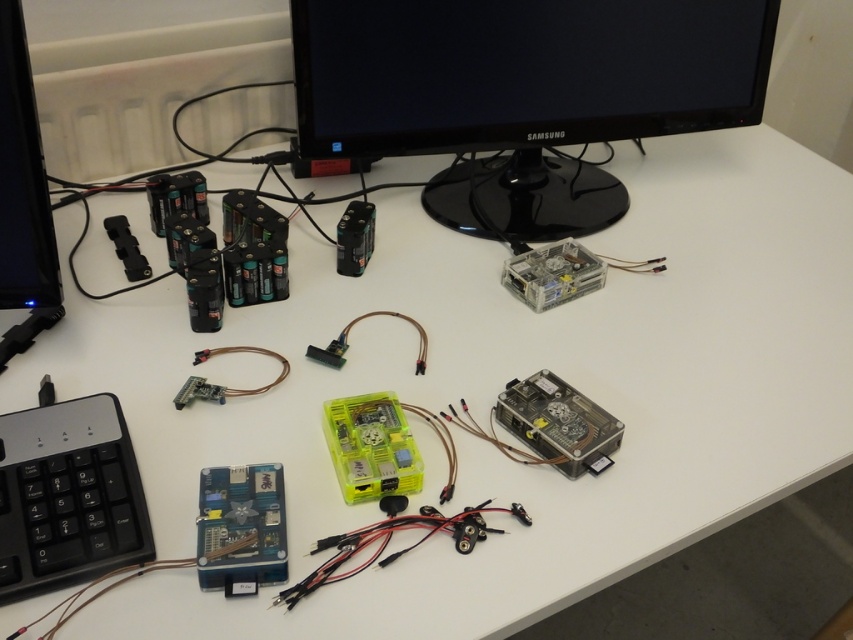
Is black glossy monitor at upper center taller than black plastic keyboard at lower left?

Indeed, black glossy monitor at upper center has a greater height compared to black plastic keyboard at lower left.

Is point (529, 99) positioned before point (131, 486)?

No.

Does point (714, 1) come behind point (77, 500)?

That is True.

Where is `black glossy monitor at upper center`? The image size is (853, 640). black glossy monitor at upper center is located at coordinates tap(521, 93).

Which is below, black plastic keyboard at lower left or blue plastic circuit board at lower left?

blue plastic circuit board at lower left

Based on the photo, is black plastic keyboard at lower left smaller than blue plastic circuit board at lower left?

Incorrect, black plastic keyboard at lower left is not smaller in size than blue plastic circuit board at lower left.

Describe the element at coordinates (67, 497) in the screenshot. I see `black plastic keyboard at lower left` at that location.

The image size is (853, 640). In order to click on black plastic keyboard at lower left in this screenshot , I will do `click(67, 497)`.

Does black glossy monitor at upper center have a smaller size compared to blue plastic circuit board at lower left?

Incorrect, black glossy monitor at upper center is not smaller in size than blue plastic circuit board at lower left.

Does black glossy monitor at upper center appear under blue plastic circuit board at lower left?

Actually, black glossy monitor at upper center is above blue plastic circuit board at lower left.

Is point (316, 0) more distant than point (238, 490)?

That is True.

Where is `black glossy monitor at upper center`? black glossy monitor at upper center is located at coordinates (521, 93).